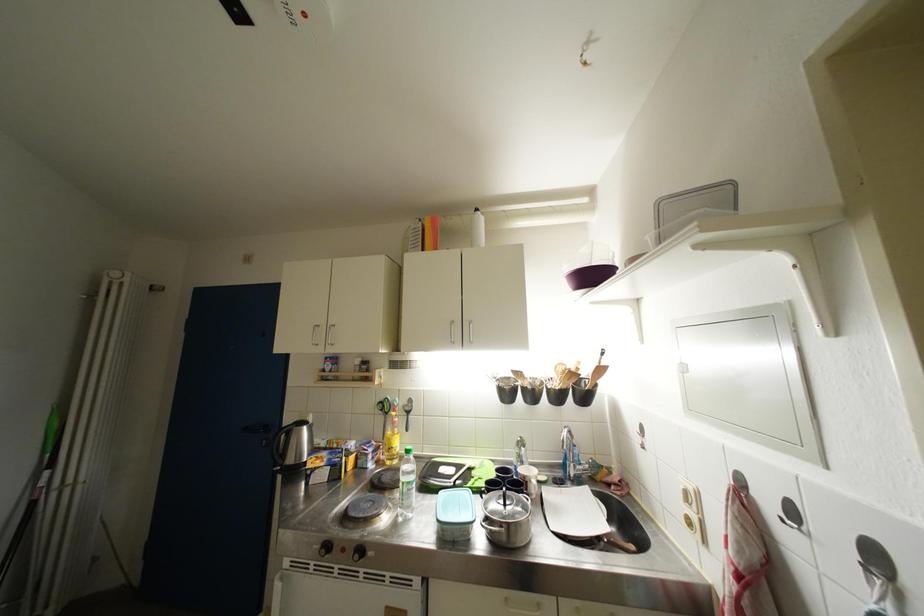
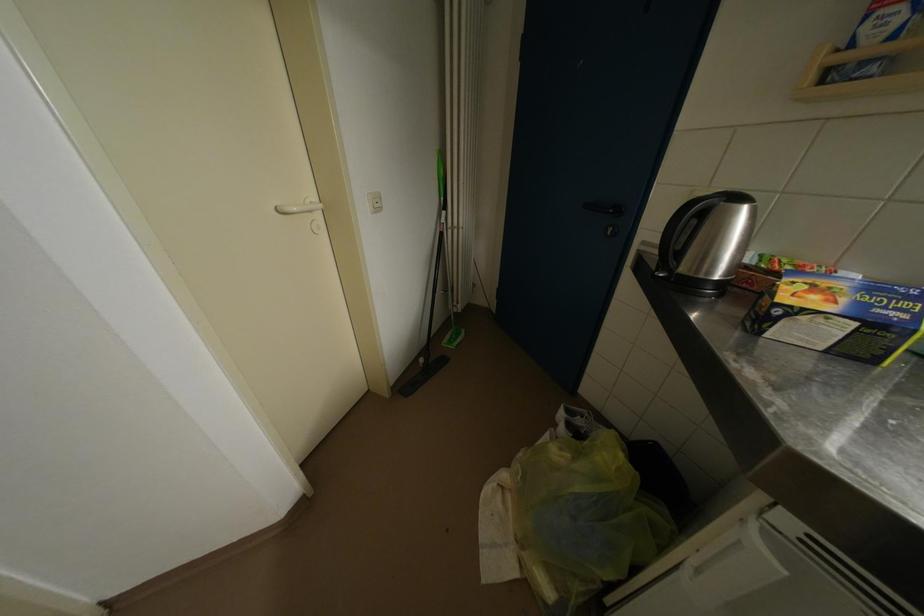
Find the pixel in the second image that matches point 56,469 in the first image.

(451, 211)